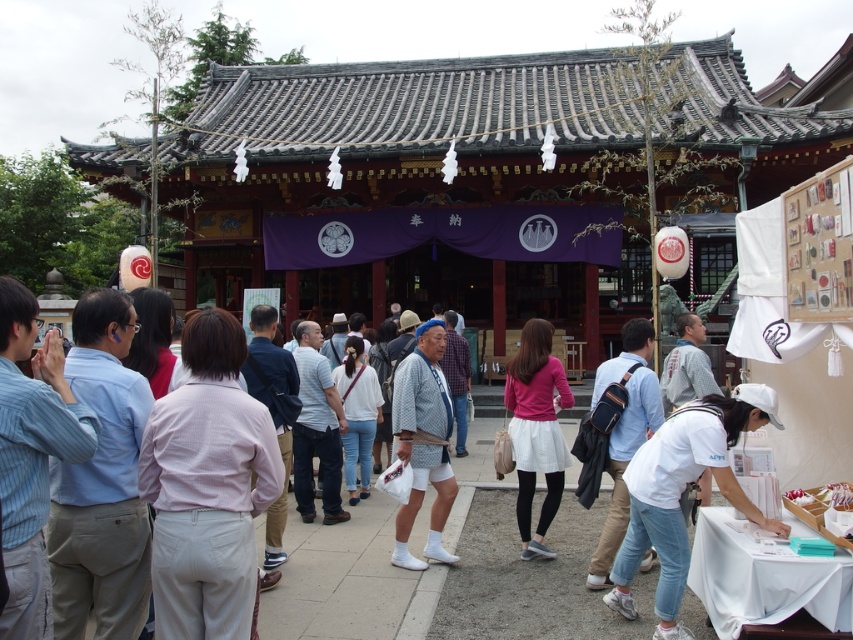
Question: Which of the following is the farthest from the observer?

Choices:
 (A) (692, 428)
 (B) (231, 532)

Answer: (A)

Question: Does blue striped shirt at left have a larger size compared to pink matte skirt at center?

Choices:
 (A) yes
 (B) no

Answer: (A)

Question: Which point is farther to the camera?

Choices:
 (A) (163, 380)
 (B) (334, 468)

Answer: (B)

Question: Can you confirm if pink fabric shirt at center is positioned below pink matte skirt at center?

Choices:
 (A) yes
 (B) no

Answer: (B)

Question: Is pink fabric shirt at center above patterned cotton kimono at center?

Choices:
 (A) no
 (B) yes

Answer: (B)

Question: Which point is farther from the camera taking this photo?

Choices:
 (A) (517, 358)
 (B) (380, 401)
 (C) (424, 385)

Answer: (B)